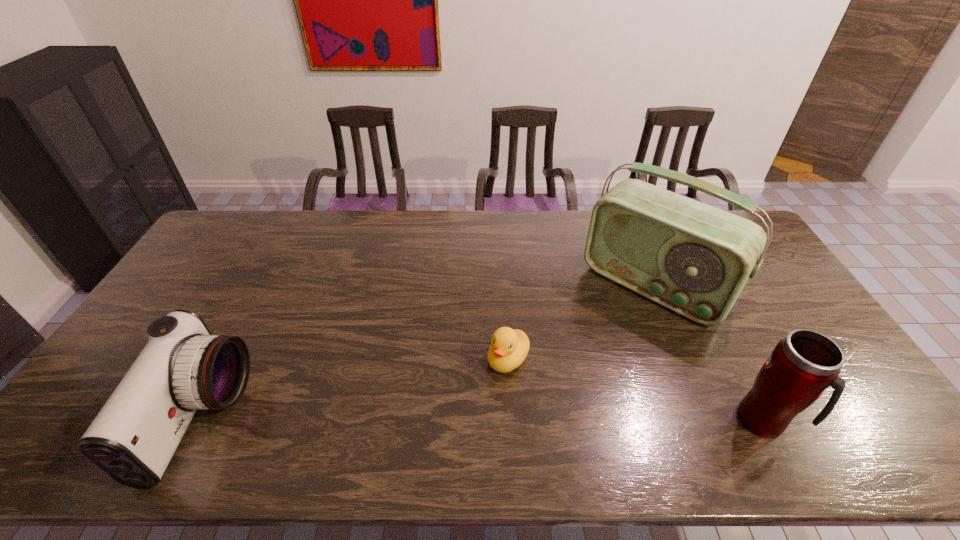
Locate an element on the screen. The height and width of the screenshot is (540, 960). the leftmost object is located at coordinates (183, 368).

The image size is (960, 540). Find the location of `camcorder`. camcorder is located at coordinates (183, 368).

Identify the location of thermos bottle. This screenshot has width=960, height=540. (802, 365).

Where is `radio receiver`? The height and width of the screenshot is (540, 960). radio receiver is located at coordinates (692, 258).

Image resolution: width=960 pixels, height=540 pixels. In order to click on the tallest object in this screenshot , I will do `click(692, 258)`.

Identify the location of duckling. (509, 347).

Where is `the second object from left to right`? the second object from left to right is located at coordinates (509, 347).

You are a GUI agent. You are given a task and a screenshot of the screen. Output one action in this format:
    pyautogui.click(x=<x>, y=<y>)
    Task: Click on the vacant position located 0.240m on the surface of the camcorder
    The width and height of the screenshot is (960, 540).
    Given the screenshot: What is the action you would take?
    pyautogui.click(x=335, y=419)

What are the coordinates of `free spot located 0.370m on the front panel of the radio receiver` in the screenshot? It's located at (550, 406).

Locate an element on the screen. vacant space located 0.050m on the front panel of the radio receiver is located at coordinates (612, 332).